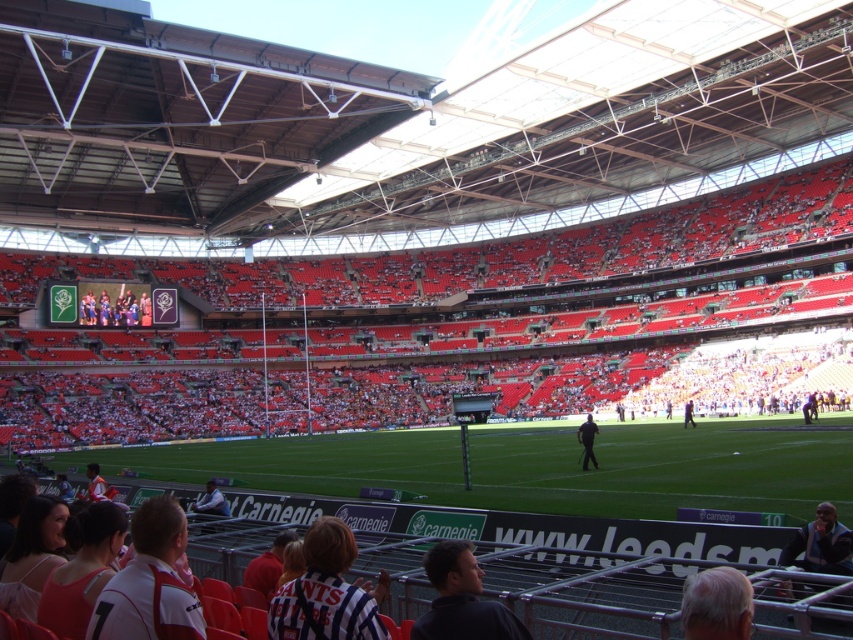
Is white jersey at lower left wider than matte black jacket at upper center?

No.

You are a GUI agent. You are given a task and a screenshot of the screen. Output one action in this format:
    pyautogui.click(x=<x>, y=<y>)
    Task: Click on the white jersey at lower left
    
    Given the screenshot: What is the action you would take?
    pyautogui.click(x=149, y=582)

In order to click on white jersey at lower left in this screenshot , I will do `click(149, 582)`.

Does striped jersey at lower center appear on the right side of light brown leather jacket at center?

In fact, striped jersey at lower center is to the left of light brown leather jacket at center.

Is the position of striped jersey at lower center less distant than that of light brown leather jacket at center?

Yes, striped jersey at lower center is in front of light brown leather jacket at center.

Find the location of a particular element. The height and width of the screenshot is (640, 853). striped jersey at lower center is located at coordinates (328, 592).

Based on the photo, does white fabric shirt at lower center have a lesser width compared to black matte person at center?

Correct, white fabric shirt at lower center's width is less than black matte person at center's.

Does white fabric shirt at lower center lie in front of black matte person at center?

Yes, it is.

You are a GUI agent. You are given a task and a screenshot of the screen. Output one action in this format:
    pyautogui.click(x=<x>, y=<y>)
    Task: Click on the white fabric shirt at lower center
    This screenshot has width=853, height=640.
    Given the screenshot: What is the action you would take?
    pyautogui.click(x=210, y=504)